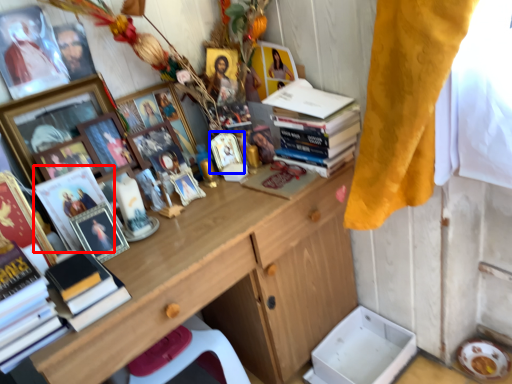
Question: Among these objects, which one is farthest to the camera, magazine (highlighted by a red box) or picture frame (highlighted by a blue box)?

Choices:
 (A) magazine
 (B) picture frame

Answer: (B)